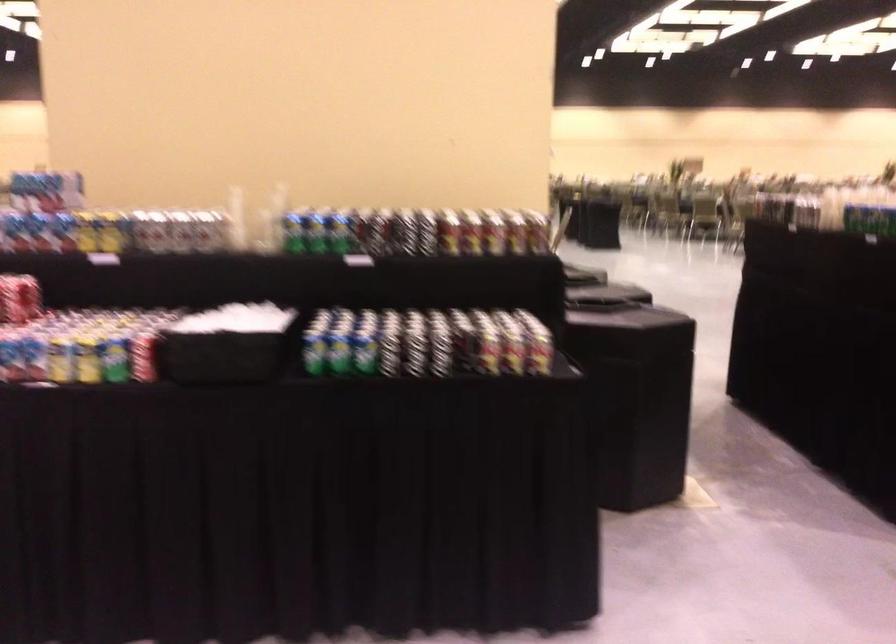
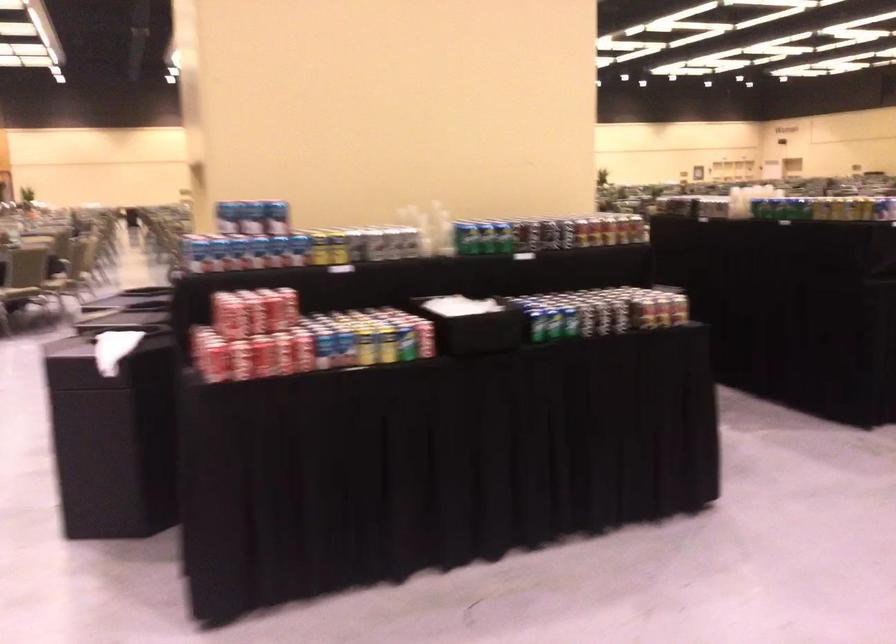
In the second image, find the point that corresponds to point (142, 230) in the first image.

(352, 245)